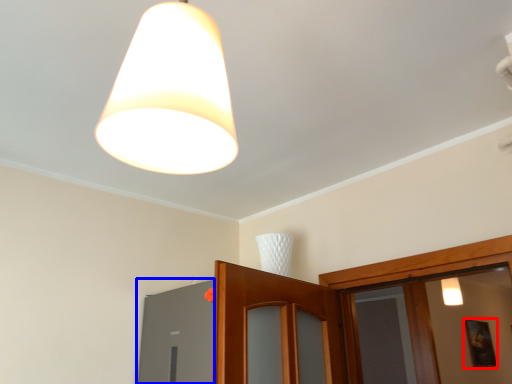
Question: Which of the following is the farthest to the observer, picture frame (highlighted by a red box) or window (highlighted by a blue box)?

Choices:
 (A) picture frame
 (B) window

Answer: (A)